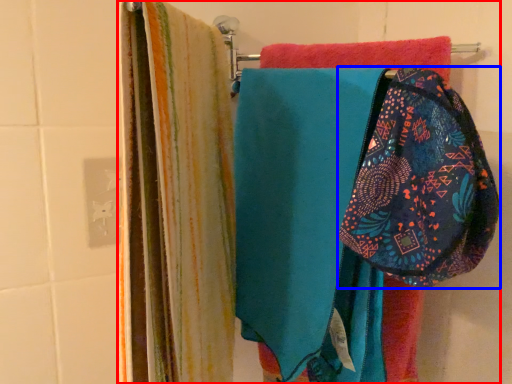
Question: Which of the following is the closest to the observer, laundry (highlighted by a red box) or pouch (highlighted by a blue box)?

Choices:
 (A) laundry
 (B) pouch

Answer: (B)